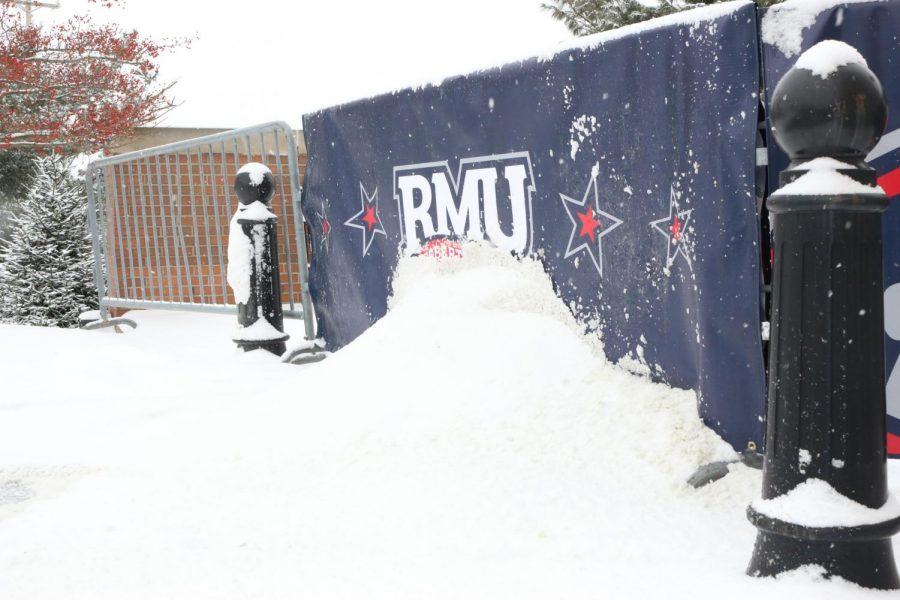
In order to click on brick wall behind barrier in this screenshot , I will do `click(185, 208)`.